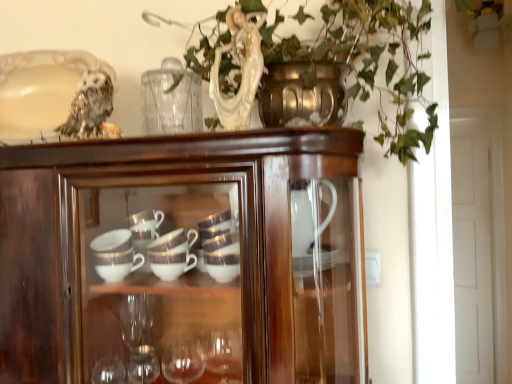
Question: From a real-world perspective, is glossy wood cupboard at center physically located above or below white glossy door at right?

Choices:
 (A) below
 (B) above

Answer: (B)

Question: Is glossy wood cupboard at center bigger or smaller than white glossy door at right?

Choices:
 (A) small
 (B) big

Answer: (B)

Question: Which of these objects is positioned farthest from the white glossy door at right?

Choices:
 (A) glossy wood cupboard at center
 (B) sparkly silver owl at upper left

Answer: (B)

Question: Estimate the real-world distances between objects in this image. Which object is farther from the glossy wood cupboard at center?

Choices:
 (A) white glossy door at right
 (B) sparkly silver owl at upper left

Answer: (A)